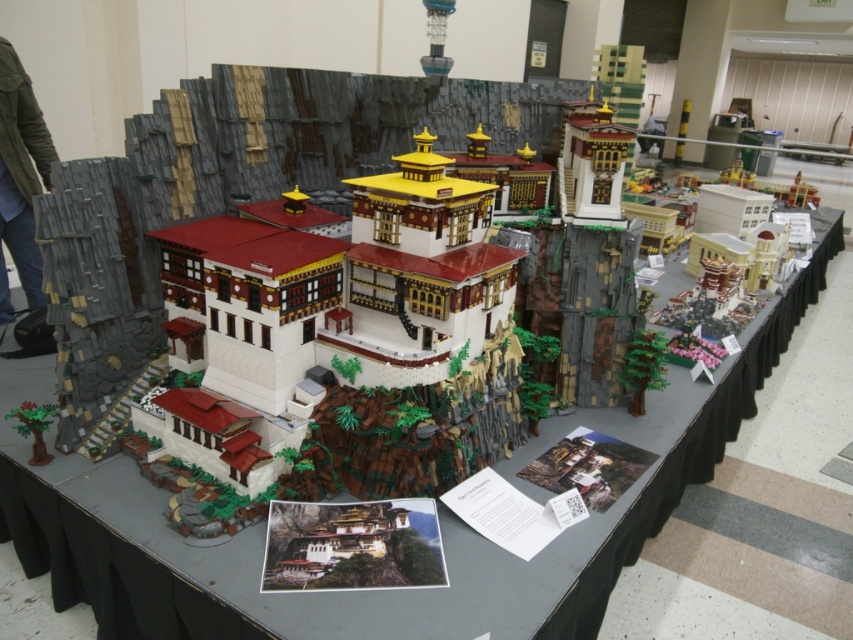
You are a small LEGO figure standing on the matte gray bricks at left and want to reach the white lego structure at center. Which direction should you move to get there?

The white lego structure at center is below the matte gray bricks at left, so you should move downward to reach it.

You are a LEGO architect designing a new expansion for the existing model. You have a new decorative element that requires a base width of 20 units. Based on the scene, which object between the white lego structure at center and the matte gray bricks at left would provide a more stable foundation for this new addition?

The white lego structure at center has a larger width than the matte gray bricks at left, so it would provide a more stable foundation for the new decorative element requiring a base width of 20 units.

You are examining a LEGO model of a Tibetan building. You notice two points marked on the image, one at coordinates point (x=165, y=561) and the other at point (x=21, y=252). Which of these points is nearer to your viewpoint as you look at the model?

Point (x=165, y=561) is closer to the camera than point (x=21, y=252).